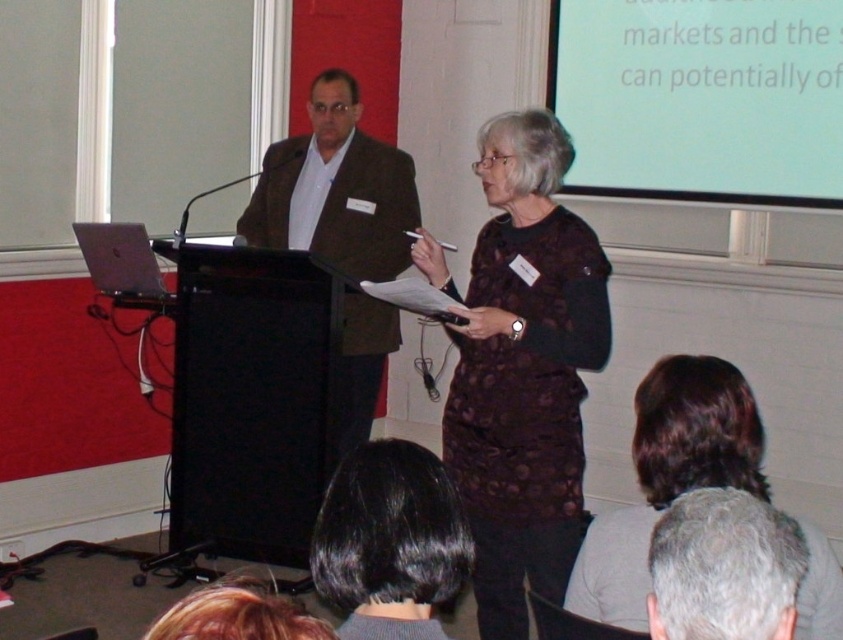
Who is more distant from viewer, (729, 150) or (369, 275)?

The point (729, 150) is more distant.

Is white matte projection screen at upper center to the left of brown textured suit at center from the viewer's perspective?

No, white matte projection screen at upper center is not to the left of brown textured suit at center.

What do you see at coordinates (701, 99) in the screenshot? This screenshot has width=843, height=640. I see `white matte projection screen at upper center` at bounding box center [701, 99].

Locate an element on the screen. The width and height of the screenshot is (843, 640). white matte projection screen at upper center is located at coordinates (701, 99).

Between dark brown textured dress at center and brown textured suit at center, which one has less height?

With less height is dark brown textured dress at center.

Can you confirm if dark brown textured dress at center is taller than brown textured suit at center?

Incorrect, dark brown textured dress at center's height is not larger of brown textured suit at center's.

Does point (586, 364) come in front of point (348, 371)?

Yes.

Where is `dark brown textured dress at center`? dark brown textured dress at center is located at coordinates (521, 369).

Is white matte projection screen at upper center wider than gray hair at upper center?

Yes, white matte projection screen at upper center is wider than gray hair at upper center.

Who is higher up, white matte projection screen at upper center or gray hair at upper center?

Positioned higher is white matte projection screen at upper center.

Which is behind, point (611, 166) or point (675, 538)?

The point (611, 166) is behind.

Locate an element on the screen. Image resolution: width=843 pixels, height=640 pixels. white matte projection screen at upper center is located at coordinates (701, 99).